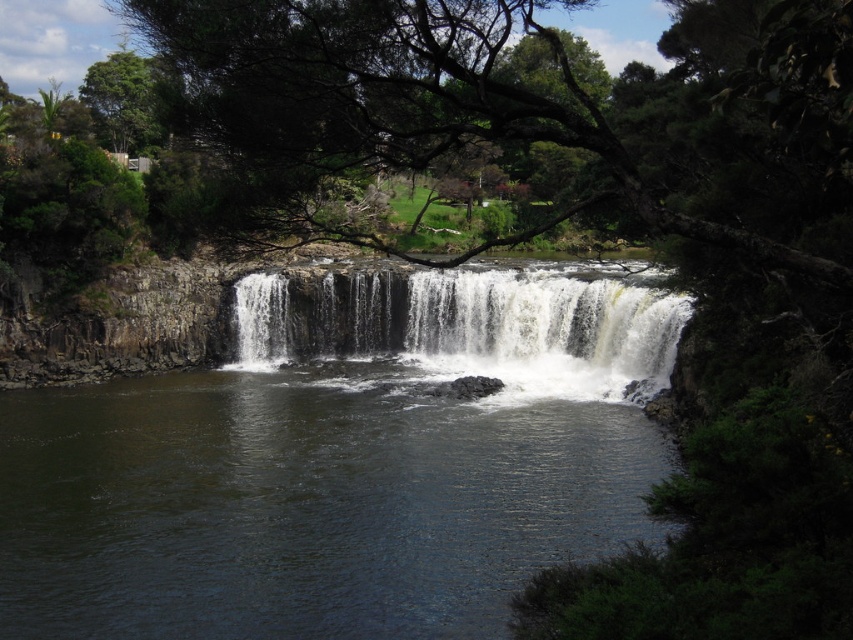
Between dark green water at center and white textured water at center, which one is positioned higher?

white textured water at center

Can you confirm if dark green water at center is positioned to the left of white textured water at center?

Correct, you'll find dark green water at center to the left of white textured water at center.

Image resolution: width=853 pixels, height=640 pixels. I want to click on dark green water at center, so click(300, 504).